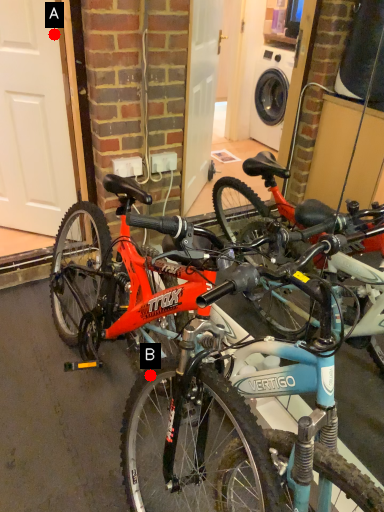
Question: Two points are circled on the image, labeled by A and B beside each circle. Which point is closer to the camera taking this photo?

Choices:
 (A) A is closer
 (B) B is closer

Answer: (B)